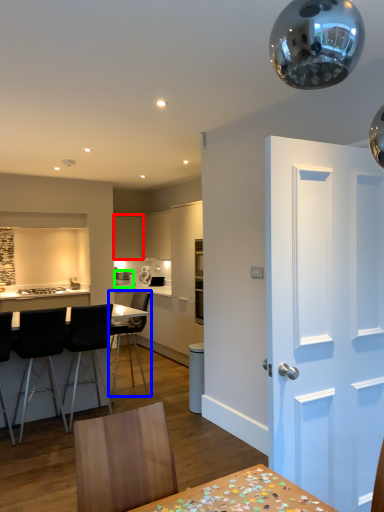
Question: Estimate the real-world distances between objects in this image. Which object is farther from cabinetry (highlighted by a red box), chair (highlighted by a blue box) or appliance (highlighted by a green box)?

Choices:
 (A) chair
 (B) appliance

Answer: (A)